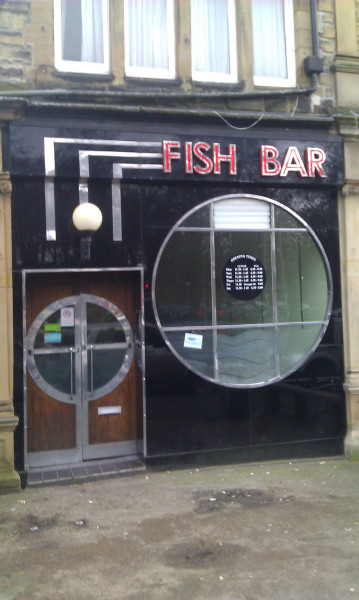
Where is `mail entry`? The width and height of the screenshot is (359, 600). mail entry is located at coordinates (109, 406).